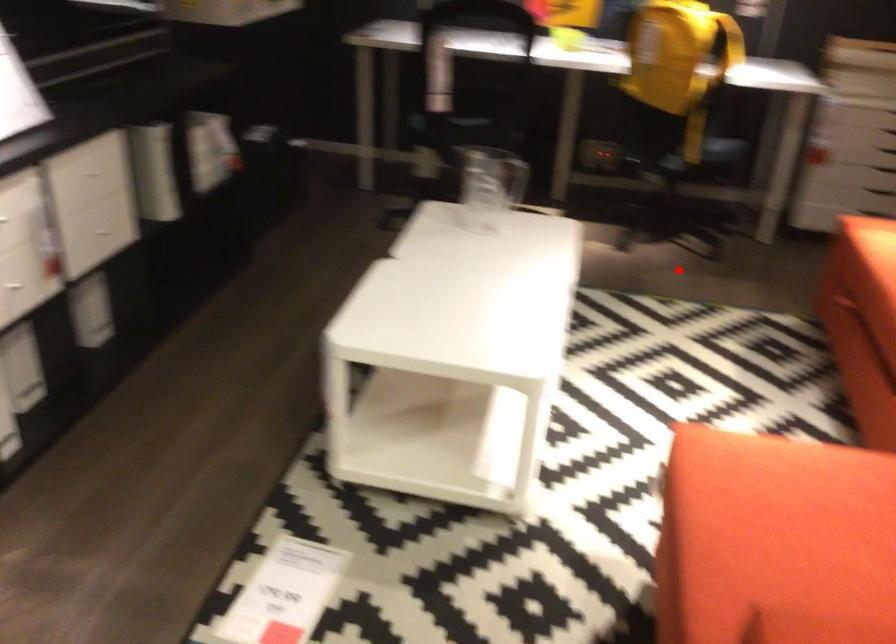
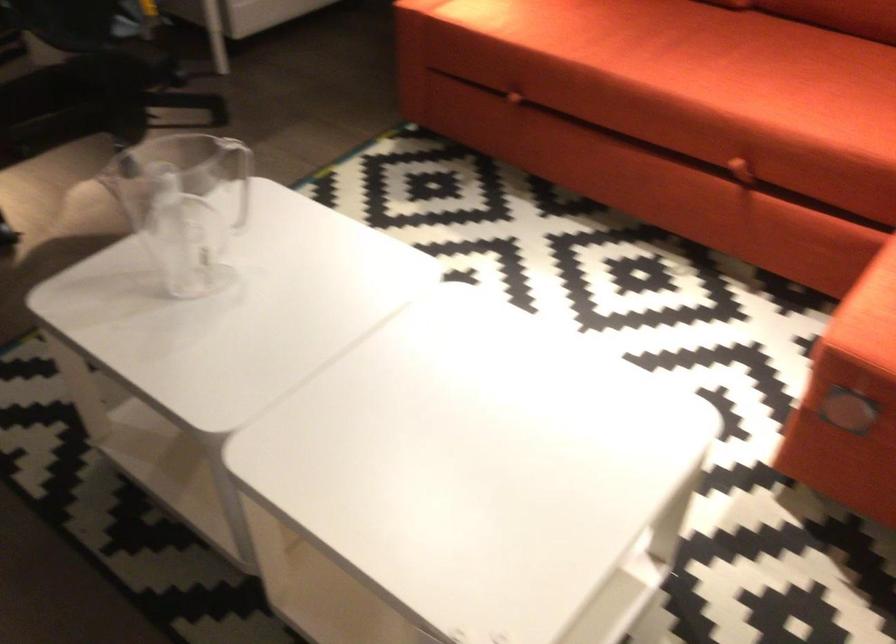
Find the pixel in the second image that matches the highlighted location in the first image.

(238, 176)